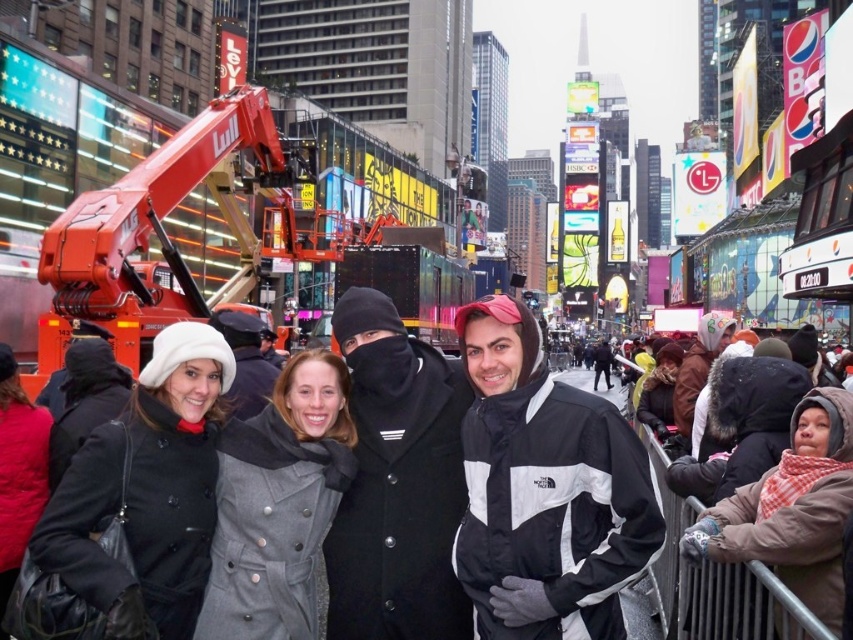
Who is higher up, black/windbreaker jacket at center or plaid scarf at center?

black/windbreaker jacket at center is higher up.

Does point (579, 618) come farther from viewer compared to point (820, 468)?

That is True.

This screenshot has width=853, height=640. I want to click on black/windbreaker jacket at center, so click(544, 490).

What do you see at coordinates (245, 362) in the screenshot?
I see `black woolen hat at left` at bounding box center [245, 362].

Looking at this image, is black woolen hat at left shorter than brown leather jacket at right?

No, black woolen hat at left is not shorter than brown leather jacket at right.

Which is in front, point (241, 336) or point (637, 403)?

Point (241, 336) is in front.

Locate an element on the screen. Image resolution: width=853 pixels, height=640 pixels. black woolen hat at left is located at coordinates (245, 362).

Looking at this image, who is taller, black/windbreaker jacket at center or brown leather jacket at right?

black/windbreaker jacket at center is taller.

Between point (500, 563) and point (645, 385), which one is positioned behind?

Positioned behind is point (645, 385).

What do you see at coordinates (544, 490) in the screenshot?
I see `black/windbreaker jacket at center` at bounding box center [544, 490].

I want to click on black/windbreaker jacket at center, so click(x=544, y=490).